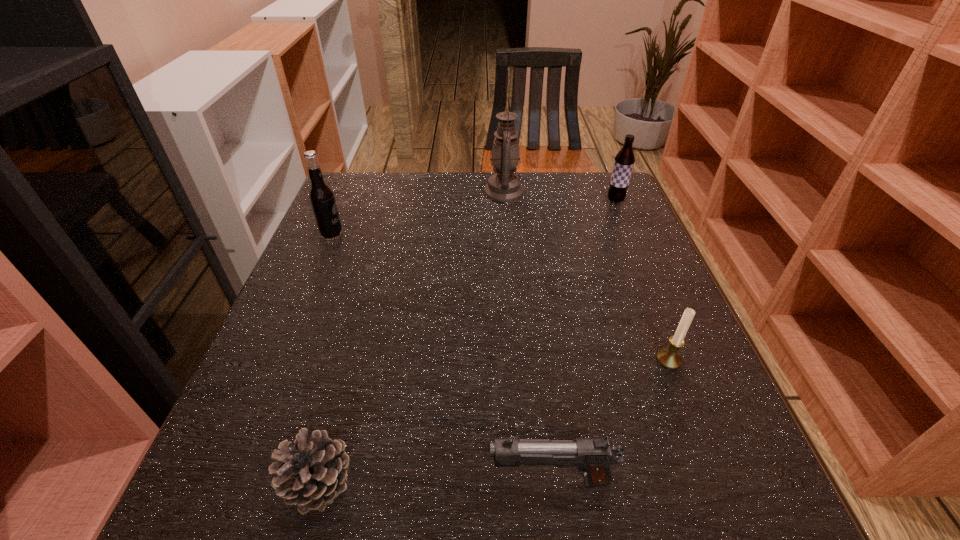
Identify the location of vacant space that is in between the left root beer and the candle holder. This screenshot has height=540, width=960. (500, 298).

The width and height of the screenshot is (960, 540). Find the location of `object that is the second closest to the second object from left to right`. object that is the second closest to the second object from left to right is located at coordinates (669, 358).

Select which object is the second closest to the gun. Please provide its 2D coordinates. Your answer should be formatted as a tuple, i.e. [(x, y)], where the tuple contains the x and y coordinates of a point satisfying the conditions above.

[(669, 358)]

This screenshot has width=960, height=540. In order to click on free region that satisfies the following two spatial constraints: 1. on the back side of the second object from left to right; 2. on the left side of the oil lamp in this screenshot , I will do `click(396, 191)`.

This screenshot has height=540, width=960. Identify the location of vacant area that satisfies the following two spatial constraints: 1. on the label of the pinecone; 2. on the left side of the leftmost object. (228, 482).

You are a GUI agent. You are given a task and a screenshot of the screen. Output one action in this format:
    pyautogui.click(x=<x>, y=<y>)
    Task: Click on the free space that satisfies the following two spatial constraints: 1. on the label of the second tallest object; 2. on the right side of the third nearest object
    The width and height of the screenshot is (960, 540).
    Given the screenshot: What is the action you would take?
    pyautogui.click(x=279, y=360)

Identify the location of vacant space that satisfies the following two spatial constraints: 1. on the front side of the candle holder; 2. in the direction the gun is aimed. The height and width of the screenshot is (540, 960). (716, 480).